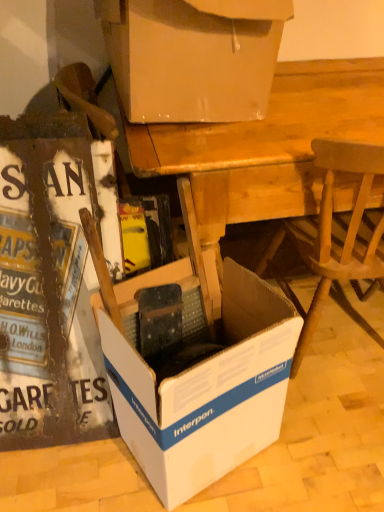
Question: From a real-world perspective, is white cardboard box at lower left, the second box from the top, physically located above or below wooden desk at center?

Choices:
 (A) below
 (B) above

Answer: (B)

Question: Is point (3, 297) closer or farther from the camera than point (332, 100)?

Choices:
 (A) closer
 (B) farther

Answer: (A)

Question: Which object is positioned closest to the white cardboard box at center, the 1th box from the bottom?

Choices:
 (A) white cardboard box at lower left, the 2th box ordered from the bottom
 (B) wooden chair at lower right
 (C) white cardboard box at upper center, which is the first box from top to bottom
 (D) wooden desk at center

Answer: (A)

Question: Considering the real-world distances, which object is closest to the white cardboard box at center, the third box viewed from the top?

Choices:
 (A) wooden chair at lower right
 (B) wooden desk at center
 (C) white cardboard box at upper center, placed as the 3th box when sorted from bottom to top
 (D) white cardboard box at lower left, the 2th box ordered from the bottom

Answer: (D)